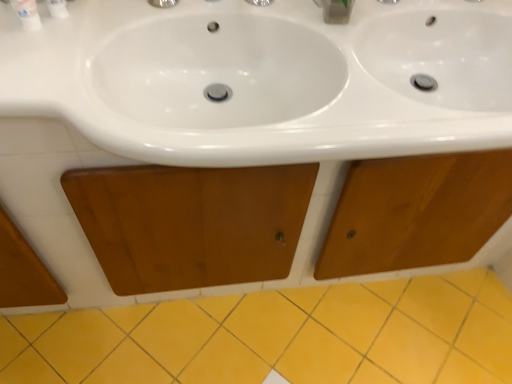
Question: Is white glossy bottle at upper left directly adjacent to wooden cabinet at center?

Choices:
 (A) yes
 (B) no

Answer: (B)

Question: Considering the relative sizes of white glossy bottle at upper left and wooden cabinet at center in the image provided, is white glossy bottle at upper left shorter than wooden cabinet at center?

Choices:
 (A) no
 (B) yes

Answer: (B)

Question: Does white glossy bottle at upper left have a smaller size compared to wooden cabinet at center?

Choices:
 (A) no
 (B) yes

Answer: (B)

Question: Is white glossy bottle at upper left closer to the viewer compared to wooden cabinet at center?

Choices:
 (A) yes
 (B) no

Answer: (B)

Question: Is white glossy bottle at upper left not inside wooden cabinet at center?

Choices:
 (A) yes
 (B) no

Answer: (A)

Question: Do you think white glossy bottle at upper left is within white plastic toothpaste tube at upper left, or outside of it?

Choices:
 (A) inside
 (B) outside

Answer: (B)

Question: From the image's perspective, is white glossy bottle at upper left above or below white plastic toothpaste tube at upper left?

Choices:
 (A) above
 (B) below

Answer: (B)

Question: From a real-world perspective, is white glossy bottle at upper left physically located above or below white plastic toothpaste tube at upper left?

Choices:
 (A) below
 (B) above

Answer: (A)

Question: Is point (28, 19) closer or farther from the camera than point (56, 6)?

Choices:
 (A) farther
 (B) closer

Answer: (B)

Question: Is yellow ceramic tile at lower center bigger or smaller than white glossy bottle at upper left?

Choices:
 (A) small
 (B) big

Answer: (B)

Question: Is point (261, 379) positioned closer to the camera than point (24, 29)?

Choices:
 (A) farther
 (B) closer

Answer: (A)

Question: Is yellow ceramic tile at lower center in front of or behind white glossy bottle at upper left in the image?

Choices:
 (A) front
 (B) behind

Answer: (B)

Question: Is yellow ceramic tile at lower center taller or shorter than white glossy bottle at upper left?

Choices:
 (A) short
 (B) tall

Answer: (A)

Question: Considering the positions of clear plastic container at upper center and white glossy bottle at upper left in the image, is clear plastic container at upper center wider or thinner than white glossy bottle at upper left?

Choices:
 (A) wide
 (B) thin

Answer: (A)

Question: From a real-world perspective, is clear plastic container at upper center physically located above or below white glossy bottle at upper left?

Choices:
 (A) below
 (B) above

Answer: (A)